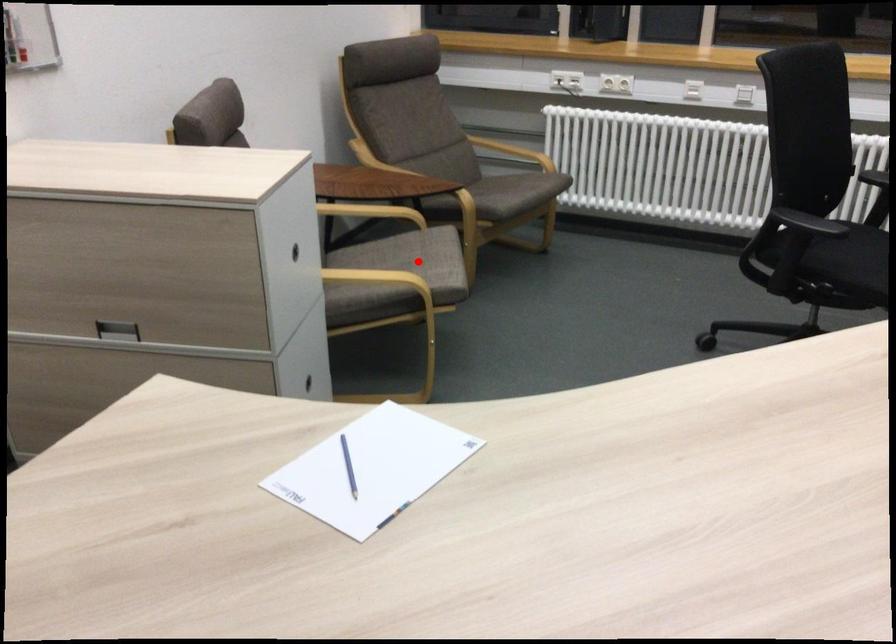
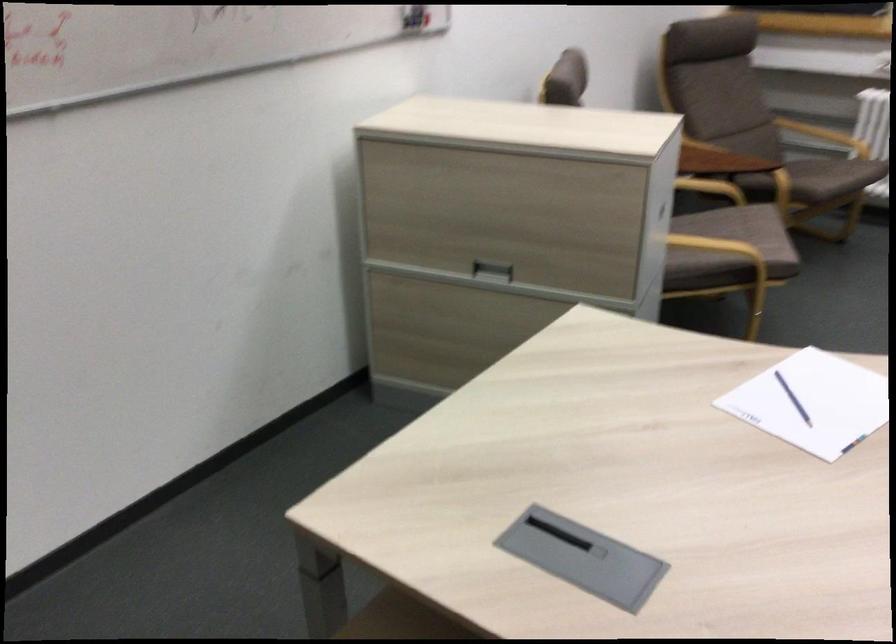
In the second image, find the point that corresponds to the highlighted location in the first image.

(746, 232)